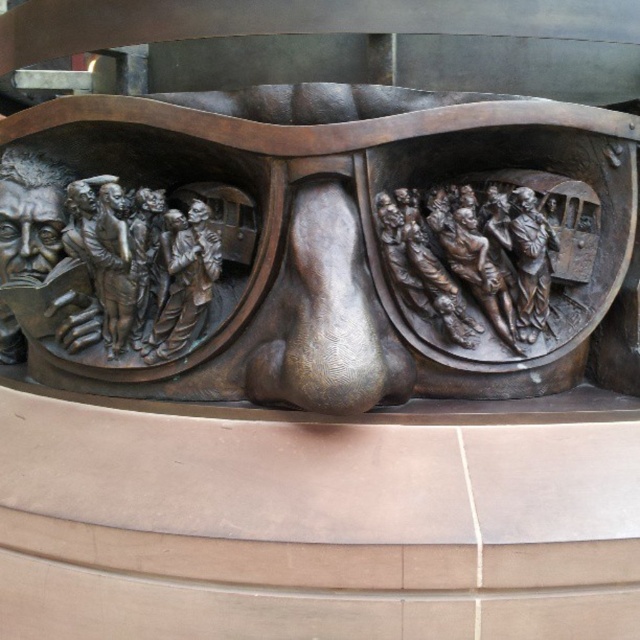
Question: Among these points, which one is farthest from the camera?

Choices:
 (A) (474, 330)
 (B) (212, 310)

Answer: (B)

Question: In this image, where is bronze sculpture at center located relative to bronze relief figures at right?

Choices:
 (A) above
 (B) below

Answer: (A)

Question: Is bronze sculpture at center thinner than bronze relief figures at right?

Choices:
 (A) yes
 (B) no

Answer: (B)

Question: Is bronze sculpture at center wider than bronze relief figures at right?

Choices:
 (A) no
 (B) yes

Answer: (B)